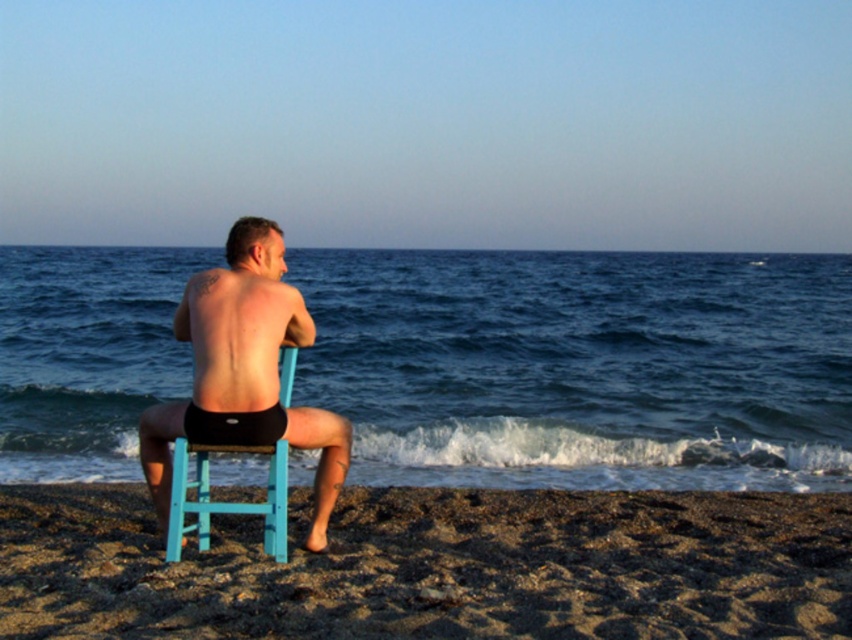
Question: Is sandy brown at lower center in front of light blue plastic chair at center?

Choices:
 (A) no
 (B) yes

Answer: (A)

Question: Is blue water at center above light blue plastic chair at center?

Choices:
 (A) no
 (B) yes

Answer: (B)

Question: Considering the real-world distances, which object is farthest from the blue water at center?

Choices:
 (A) sandy brown at lower center
 (B) black matte shorts at center
 (C) light blue plastic chair at center

Answer: (A)

Question: Among these points, which one is nearest to the camera?

Choices:
 (A) (193, 298)
 (B) (292, 374)
 (C) (297, 618)
 (D) (752, 342)

Answer: (C)

Question: Which of the following is the closest to the observer?

Choices:
 (A) (235, 451)
 (B) (614, 504)
 (C) (257, 332)

Answer: (C)

Question: In this image, where is blue water at center located relative to light blue plastic chair at center?

Choices:
 (A) above
 (B) below

Answer: (A)